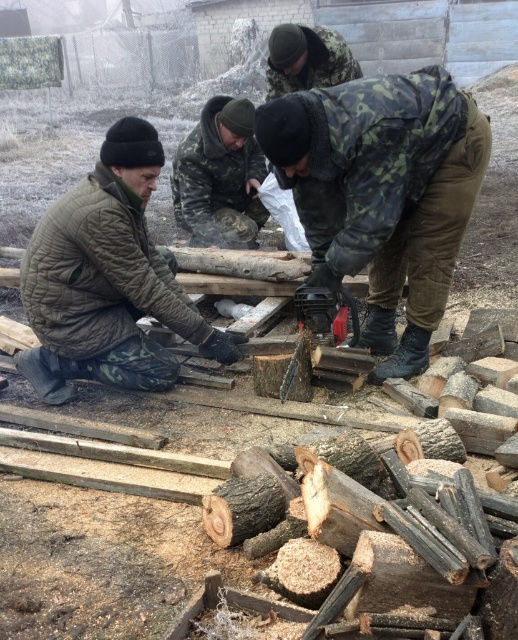
You are a photographer trying to capture a photo of the woodcutting scene. You want to position yourself so that both the camouflage jacket at left and the camouflage fabric jacket at upper center are visible in the frame. Based on their positions, which jacket should you focus on first to ensure both are in the shot?

You should focus on the camouflage jacket at left first since it is positioned to the left of the camouflage fabric jacket at upper center, ensuring both are captured in the frame.

You are standing at the origin point in the image. Where is the camouflage jacket at center located in terms of coordinates?

The camouflage jacket at center is located at coordinates point (220, 177).

You are a photographer trying to capture a photo of the woodcutting scene. You notice two jackets in the image, the camo fabric jacket at center and the camouflage fabric jacket at upper center. Which jacket appears larger in the photo?

The camo fabric jacket at center appears larger because it is taller than the camouflage fabric jacket at upper center.